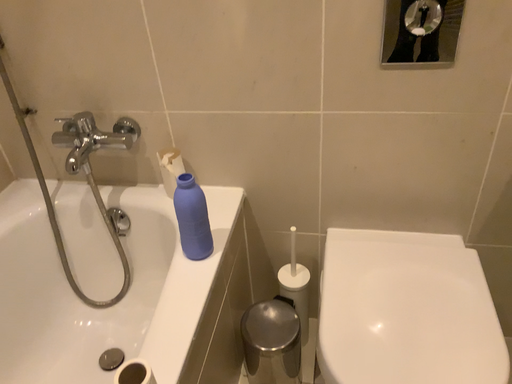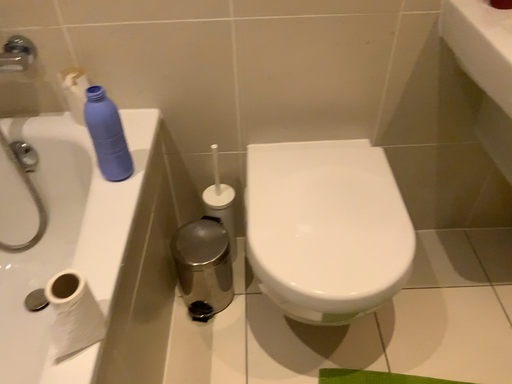
Question: How did the camera likely rotate when shooting the video?

Choices:
 (A) rotated upward
 (B) rotated downward

Answer: (B)